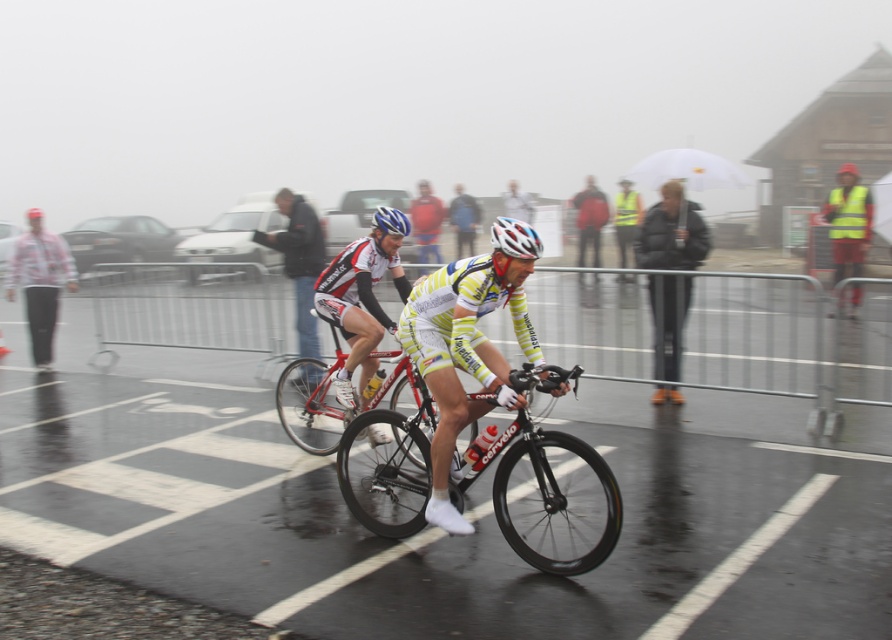
Question: Which object is the farthest from the yellow/white jersey at center?

Choices:
 (A) shiny red bicycle at center
 (B) white matte bicycle helmet at center
 (C) blue matte bicycle helmet at center
 (D) shiny black bicycle at center

Answer: (C)

Question: Considering the real-world distances, which object is farthest from the yellow/white jersey at center?

Choices:
 (A) shiny red bicycle at center
 (B) dark gray jacket at center
 (C) blue matte bicycle helmet at center
 (D) shiny black bicycle at center

Answer: (B)

Question: Among these points, which one is farthest from the camera?

Choices:
 (A) (401, 225)
 (B) (416, 296)

Answer: (A)

Question: Is white matte bicycle helmet at center to the right of blue matte bicycle helmet at center from the viewer's perspective?

Choices:
 (A) no
 (B) yes

Answer: (B)

Question: Is yellow/white jersey at center above dark gray jacket at center?

Choices:
 (A) yes
 (B) no

Answer: (B)

Question: Is shiny black bicycle at center smaller than dark gray jacket at center?

Choices:
 (A) no
 (B) yes

Answer: (A)